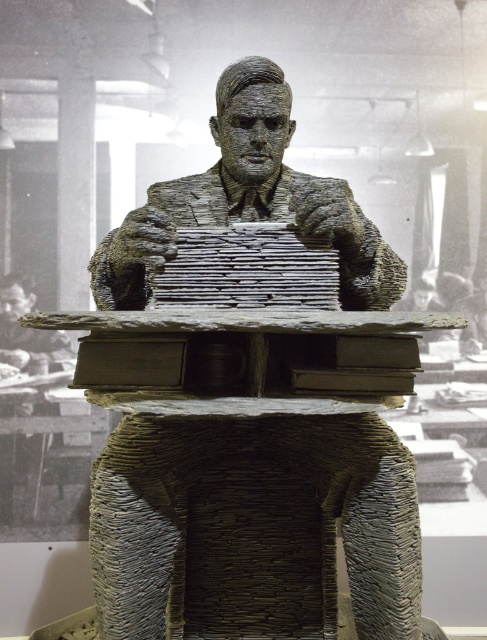
Which is in front, point (276, 608) or point (7, 440)?

Point (276, 608) is in front.

Between point (237, 484) and point (14, 392), which one is positioned behind?

The point (14, 392) is more distant.

Between point (190, 488) and point (2, 356), which one is positioned behind?

Positioned behind is point (2, 356).

Find the location of a particular element. The height and width of the screenshot is (640, 487). rustic stone table at center is located at coordinates (251, 474).